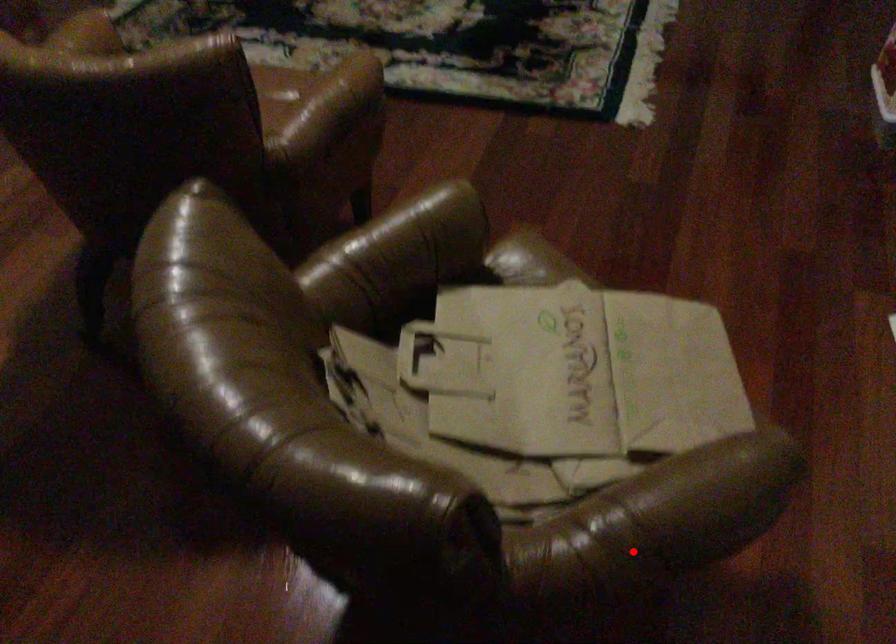
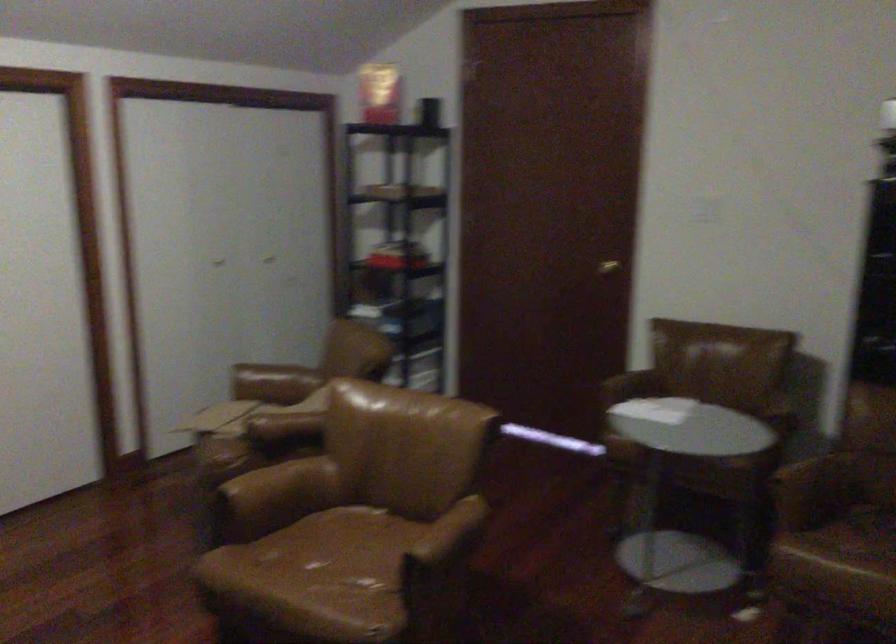
Question: I am providing you with two images of the same scene from different viewpoints. A red point is marked on the first image. Is the red point's position out of view in image 2?

Choices:
 (A) Yes
 (B) No

Answer: (B)